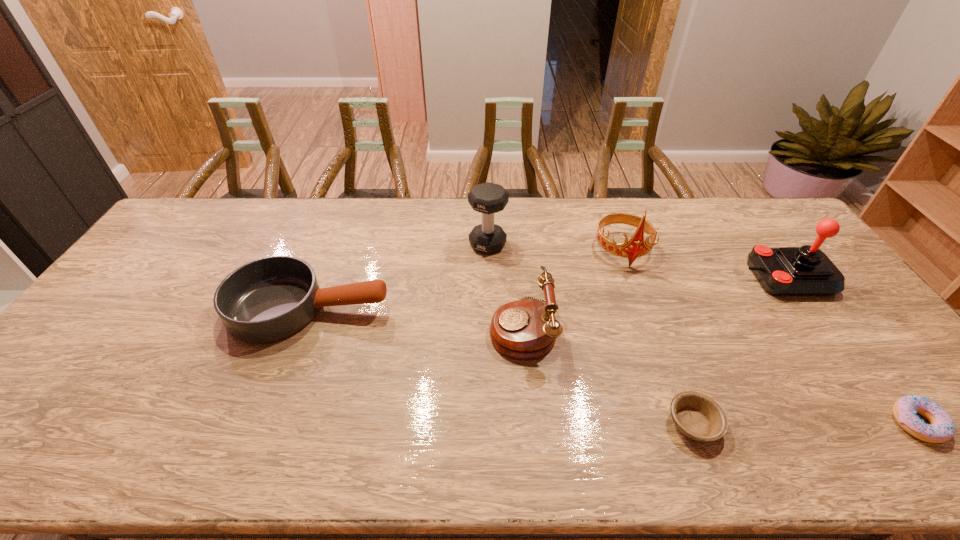
Point out which object is positioned as the third nearest to the tiara. Please provide its 2D coordinates. Your answer should be formatted as a tuple, i.e. [(x, y)], where the tuple contains the x and y coordinates of a point satisfying the conditions above.

[(487, 198)]

In order to click on object that is the third closest to the fourth shortest object in this screenshot , I will do `click(697, 416)`.

Find the location of a particular element. free space in the image that satisfies the following two spatial constraints: 1. on the front-facing side of the tiara; 2. on the dial of the fourth tallest object is located at coordinates (651, 327).

Find the location of a particular element. Image resolution: width=960 pixels, height=540 pixels. free location that satisfies the following two spatial constraints: 1. on the handle side of the pan; 2. on the right side of the bowl is located at coordinates (266, 423).

In order to click on vacant space that satisfies the following two spatial constraints: 1. on the front side of the dumbbell; 2. on the right side of the doughnut in this screenshot , I will do `click(492, 423)`.

This screenshot has width=960, height=540. In order to click on blank space that satisfies the following two spatial constraints: 1. on the back side of the bowl; 2. on the handle side of the leftmost object in this screenshot , I will do `click(650, 308)`.